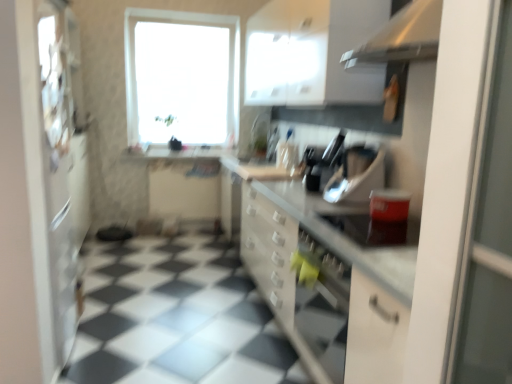
Find the location of `transparent glass window at upper center`. transparent glass window at upper center is located at coordinates (182, 77).

What is the approximate width of transparent glass window at upper center?

transparent glass window at upper center is 11.89 inches wide.

The height and width of the screenshot is (384, 512). What are the coordinates of `matte black toaster at center, the third appliance viewed from the back` in the screenshot? It's located at (375, 230).

Measure the distance between point (x=349, y=227) and camera.

Point (x=349, y=227) is 7.22 feet away from camera.

The image size is (512, 384). What do you see at coordinates (322, 162) in the screenshot? I see `black plastic knife block at center, which is the first appliance from back to front` at bounding box center [322, 162].

Image resolution: width=512 pixels, height=384 pixels. Describe the element at coordinates (328, 274) in the screenshot. I see `white glossy countertop at center` at that location.

Identify the location of transparent glass window at upper center. (182, 77).

From the image's perspective, is transparent glass window at upper center over black plastic knife block at center, which is the first appliance from back to front?

Yes, from the image's perspective, transparent glass window at upper center is over black plastic knife block at center, which is the first appliance from back to front.

Is transparent glass window at upper center smaller than black plastic knife block at center, which is the first appliance from back to front?

No, transparent glass window at upper center is not smaller than black plastic knife block at center, which is the first appliance from back to front.

Is transparent glass window at upper center turned away from black plastic knife block at center, placed as the third appliance when sorted from front to back?

No, transparent glass window at upper center is not facing away from black plastic knife block at center, placed as the third appliance when sorted from front to back.

Where is `the 1st appliance in front when counting from the transparent glass window at upper center`? Image resolution: width=512 pixels, height=384 pixels. the 1st appliance in front when counting from the transparent glass window at upper center is located at coordinates (322, 162).

Which object is thinner, white glossy cabinet at upper center or metallic silver toaster at center, placed as the 2th appliance when sorted from front to back?

With smaller width is metallic silver toaster at center, placed as the 2th appliance when sorted from front to back.

Which object is further away from the camera, white glossy cabinet at upper center or metallic silver toaster at center, placed as the 2th appliance when sorted from front to back?

white glossy cabinet at upper center is behind.

From a real-world perspective, is white glossy cabinet at upper center on top of metallic silver toaster at center, which is counted as the second appliance, starting from the back?

Indeed, from a real-world perspective, white glossy cabinet at upper center stands above metallic silver toaster at center, which is counted as the second appliance, starting from the back.

Is metallic silver toaster at center, placed as the 2th appliance when sorted from front to back, located within white glossy cabinet at upper center?

No, metallic silver toaster at center, placed as the 2th appliance when sorted from front to back, is not a part of white glossy cabinet at upper center.

In terms of width, does black glossy tile at center look wider or thinner when compared to black plastic knife block at center, which is the first appliance from back to front?

black glossy tile at center is wider than black plastic knife block at center, which is the first appliance from back to front.

Is black glossy tile at center beside black plastic knife block at center, placed as the third appliance when sorted from front to back?

black glossy tile at center is not next to black plastic knife block at center, placed as the third appliance when sorted from front to back, and they're not touching.

Is black glossy tile at center aimed at black plastic knife block at center, placed as the third appliance when sorted from front to back?

No, black glossy tile at center is not facing towards black plastic knife block at center, placed as the third appliance when sorted from front to back.

Is black glossy tile at center taller than black plastic knife block at center, which is the first appliance from back to front?

In fact, black glossy tile at center may be shorter than black plastic knife block at center, which is the first appliance from back to front.

From a real-world perspective, which object stands above the other?

white glossy cabinet at upper center, from a real-world perspective.

Can you confirm if white glossy countertop at center is shorter than white glossy cabinet at upper center?

In fact, white glossy countertop at center may be taller than white glossy cabinet at upper center.

From the image's perspective, is white glossy countertop at center over white glossy cabinet at upper center?

No, from the image's perspective, white glossy countertop at center is not above white glossy cabinet at upper center.

Considering the sizes of objects black glossy tile at center and white glossy cabinet at upper center in the image provided, who is smaller, black glossy tile at center or white glossy cabinet at upper center?

Smaller between the two is black glossy tile at center.

Is the position of black glossy tile at center less distant than that of white glossy cabinet at upper center?

Yes, black glossy tile at center is closer to the camera.

Which point is more forward, (179, 262) or (339, 31)?

The point (339, 31) is more forward.

In terms of width, does transparent glass window at upper center look wider or thinner when compared to white matte refrigerator at left?

Considering their sizes, transparent glass window at upper center looks broader than white matte refrigerator at left.

Is point (187, 37) closer or farther from the camera than point (66, 149)?

Point (187, 37) appears to be farther away from the viewer than point (66, 149).

How different are the orientations of transparent glass window at upper center and white matte refrigerator at left in degrees?

They differ by 90.2 degrees in their facing directions.

From a real-world perspective, is transparent glass window at upper center over white matte refrigerator at left?

Correct, in the physical world, transparent glass window at upper center is higher than white matte refrigerator at left.

Starting from the black plastic knife block at center, placed as the third appliance when sorted from front to back, which appliance is the 2nd one to the right? Please provide its 2D coordinates.

[(357, 176)]

Does black plastic knife block at center, which is the first appliance from back to front, have a lesser width compared to metallic silver toaster at center, placed as the 2th appliance when sorted from front to back?

Yes, black plastic knife block at center, which is the first appliance from back to front, is thinner than metallic silver toaster at center, placed as the 2th appliance when sorted from front to back.

Could metallic silver toaster at center, which is counted as the second appliance, starting from the back, be considered to be inside black plastic knife block at center, placed as the third appliance when sorted from front to back?

That's incorrect, metallic silver toaster at center, which is counted as the second appliance, starting from the back, is not inside black plastic knife block at center, placed as the third appliance when sorted from front to back.

Is black plastic knife block at center, which is the first appliance from back to front, oriented away from metallic silver toaster at center, placed as the 2th appliance when sorted from front to back?

No, metallic silver toaster at center, placed as the 2th appliance when sorted from front to back, is not at the back of black plastic knife block at center, which is the first appliance from back to front.

I want to click on the 1st appliance counting from the right of the transparent glass window at upper center, so click(x=322, y=162).

You are a GUI agent. You are given a task and a screenshot of the screen. Output one action in this format:
    pyautogui.click(x=<x>, y=<y>)
    Task: Click on the cabinetry on the left side of metallic silver toaster at center, which is counted as the second appliance, starting from the back
    This screenshot has width=512, height=384.
    Given the screenshot: What is the action you would take?
    pyautogui.click(x=309, y=52)

Which object lies further to the anchor point white matte refrigerator at left, white glossy countertop at center or black plastic knife block at center, placed as the third appliance when sorted from front to back?

black plastic knife block at center, placed as the third appliance when sorted from front to back, is further to white matte refrigerator at left.

Estimate the real-world distances between objects in this image. Which object is closer to white glossy countertop at center, metallic silver toaster at center, placed as the 2th appliance when sorted from front to back, or matte black toaster at center, which is counted as the first appliance, starting from the front?

The object closer to white glossy countertop at center is matte black toaster at center, which is counted as the first appliance, starting from the front.

Looking at the image, which one is located further to white matte refrigerator at left, metallic silver toaster at center, placed as the 2th appliance when sorted from front to back, or white glossy exhaust hood at upper right?

white glossy exhaust hood at upper right lies further to white matte refrigerator at left than the other object.

Estimate the real-world distances between objects in this image. Which object is closer to black plastic knife block at center, which is the first appliance from back to front, metallic silver toaster at center, placed as the 2th appliance when sorted from front to back, or black glossy tile at center?

metallic silver toaster at center, placed as the 2th appliance when sorted from front to back, lies closer to black plastic knife block at center, which is the first appliance from back to front, than the other object.

Estimate the real-world distances between objects in this image. Which object is further from metallic silver toaster at center, which is counted as the second appliance, starting from the back, transparent glass window at upper center or matte black toaster at center, the third appliance viewed from the back?

transparent glass window at upper center is further to metallic silver toaster at center, which is counted as the second appliance, starting from the back.

Which object lies further to the anchor point transparent glass window at upper center, white glossy exhaust hood at upper right or black glossy tile at center?

The object further to transparent glass window at upper center is white glossy exhaust hood at upper right.

When comparing their distances from white glossy countertop at center, does transparent glass window at upper center or metallic silver toaster at center, placed as the 2th appliance when sorted from front to back, seem closer?

metallic silver toaster at center, placed as the 2th appliance when sorted from front to back.

From the image, which object appears to be farther from white glossy countertop at center, white glossy exhaust hood at upper right or matte black toaster at center, which is counted as the first appliance, starting from the front?

white glossy exhaust hood at upper right is further to white glossy countertop at center.

Where is `countertop between black glossy tile at center and matte black toaster at center, the third appliance viewed from the back, in the horizontal direction`? The height and width of the screenshot is (384, 512). countertop between black glossy tile at center and matte black toaster at center, the third appliance viewed from the back, in the horizontal direction is located at coordinates pos(328,274).

Locate an element on the screen. This screenshot has height=384, width=512. countertop between white glossy cabinet at upper center and black glossy tile at center in the vertical direction is located at coordinates (328, 274).

At what (x,y) coordinates should I click in order to perform the action: click on tile between white matte refrigerator at left and black plastic knife block at center, which is the first appliance from back to front, from left to right. Please return your answer as a coordinate pair (x, y). Looking at the image, I should click on (175, 317).

I want to click on tile between white glossy countertop at center and black plastic knife block at center, placed as the third appliance when sorted from front to back, in the front-back direction, so click(x=175, y=317).